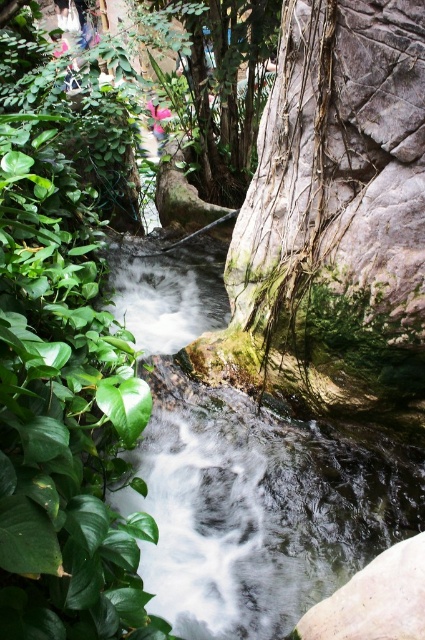
Question: Which of the following is the closest to the observer?

Choices:
 (A) white frothy water at center
 (B) green leafy plant at left

Answer: (B)

Question: Does green leafy plant at left have a greater width compared to white frothy water at center?

Choices:
 (A) yes
 (B) no

Answer: (B)

Question: Can you confirm if green leafy plant at left is positioned to the left of white frothy water at center?

Choices:
 (A) yes
 (B) no

Answer: (B)

Question: Can you confirm if green leafy plant at left is positioned to the left of white frothy water at center?

Choices:
 (A) yes
 (B) no

Answer: (B)